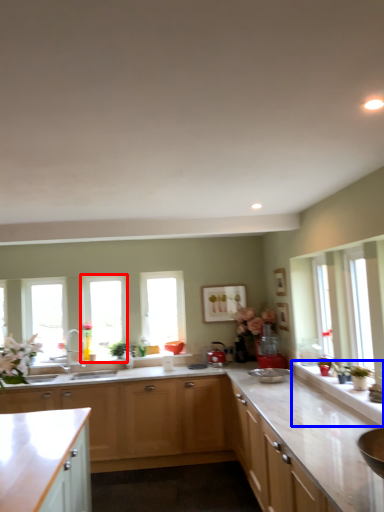
Question: Which object is further to the camera taking this photo, window (highlighted by a red box) or counter top (highlighted by a blue box)?

Choices:
 (A) window
 (B) counter top

Answer: (A)